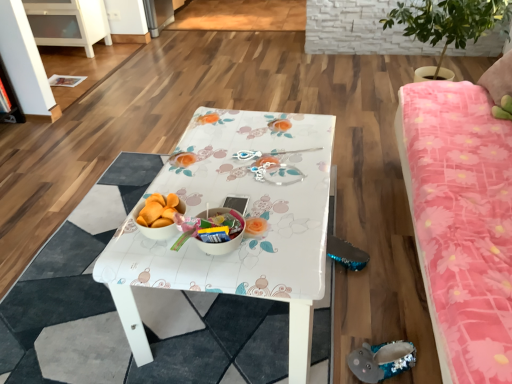
Question: Can you confirm if pink floral fabric studio couch at right is positioned to the right of green leafy plant at upper right?

Choices:
 (A) no
 (B) yes

Answer: (A)

Question: Is pink floral fabric studio couch at right further to the viewer compared to green leafy plant at upper right?

Choices:
 (A) no
 (B) yes

Answer: (A)

Question: Is pink floral fabric studio couch at right next to green leafy plant at upper right and touching it?

Choices:
 (A) no
 (B) yes

Answer: (A)

Question: Is pink floral fabric studio couch at right oriented towards green leafy plant at upper right?

Choices:
 (A) yes
 (B) no

Answer: (B)

Question: From the image's perspective, is pink floral fabric studio couch at right located beneath green leafy plant at upper right?

Choices:
 (A) yes
 (B) no

Answer: (A)

Question: Looking at the image, does white glossy cabinet at upper left seem bigger or smaller compared to pink floral fabric studio couch at right?

Choices:
 (A) big
 (B) small

Answer: (B)

Question: Is white glossy cabinet at upper left taller or shorter than pink floral fabric studio couch at right?

Choices:
 (A) short
 (B) tall

Answer: (A)

Question: In terms of width, does white glossy cabinet at upper left look wider or thinner when compared to pink floral fabric studio couch at right?

Choices:
 (A) thin
 (B) wide

Answer: (A)

Question: Based on their positions, is white glossy cabinet at upper left located to the left or right of pink floral fabric studio couch at right?

Choices:
 (A) left
 (B) right

Answer: (A)

Question: From their relative heights in the image, would you say white glossy table at center is taller or shorter than sequined gray slipper at lower right?

Choices:
 (A) short
 (B) tall

Answer: (B)

Question: Based on their sizes in the image, would you say white glossy table at center is bigger or smaller than sequined gray slipper at lower right?

Choices:
 (A) small
 (B) big

Answer: (B)

Question: From the image's perspective, is white glossy table at center located above or below sequined gray slipper at lower right?

Choices:
 (A) below
 (B) above

Answer: (B)

Question: Considering their positions, is white glossy table at center located in front of or behind sequined gray slipper at lower right?

Choices:
 (A) front
 (B) behind

Answer: (A)

Question: Looking at the image, does sequined gray slipper at lower right seem bigger or smaller compared to pink floral fabric studio couch at right?

Choices:
 (A) small
 (B) big

Answer: (A)

Question: From the image's perspective, is sequined gray slipper at lower right located above or below pink floral fabric studio couch at right?

Choices:
 (A) above
 (B) below

Answer: (B)